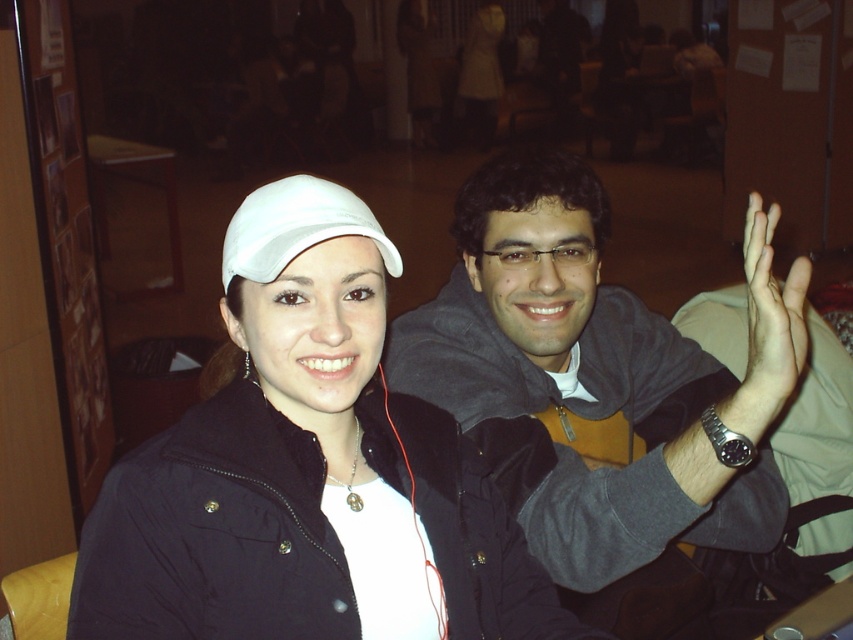
Looking at this image, how much distance is there between white matte cap at center and matte skin hand at upper right?

white matte cap at center is 17.74 inches away from matte skin hand at upper right.

Can you confirm if white matte cap at center is positioned to the left of matte skin hand at upper right?

Correct, you'll find white matte cap at center to the left of matte skin hand at upper right.

Measure the distance between point (369, 212) and camera.

Point (369, 212) and camera are 36.34 inches apart.

Where is `white matte cap at center`? This screenshot has width=853, height=640. white matte cap at center is located at coordinates (294, 227).

In the scene shown: Does matte gray hoodie at center appear under white matte cap at center?

Yes.

Does matte gray hoodie at center come behind white matte cap at center?

Yes, matte gray hoodie at center is behind white matte cap at center.

Who is more forward, (x=712, y=410) or (x=318, y=188)?

Point (x=318, y=188) is in front.

Locate an element on the screen. matte gray hoodie at center is located at coordinates (602, 372).

Is white matte cap at upper left to the left of matte gray hoodie at center from the viewer's perspective?

Correct, you'll find white matte cap at upper left to the left of matte gray hoodie at center.

Is point (381, 280) positioned before point (770, 225)?

Yes.

The width and height of the screenshot is (853, 640). Identify the location of white matte cap at upper left. (306, 472).